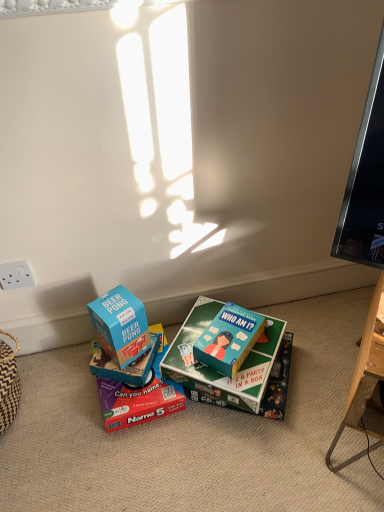
Question: From the image's perspective, is blue cardboard box at center, marked as the 4th box in a right-to-left arrangement, beneath white plastic power outlet at lower left?

Choices:
 (A) no
 (B) yes

Answer: (B)

Question: Is blue cardboard box at center, the second box when ordered from left to right, positioned behind white plastic power outlet at lower left?

Choices:
 (A) no
 (B) yes

Answer: (B)

Question: Is blue cardboard box at center, the second box when ordered from left to right, directly adjacent to white plastic power outlet at lower left?

Choices:
 (A) no
 (B) yes

Answer: (A)

Question: Is blue cardboard box at center, the second box when ordered from left to right, shorter than white plastic power outlet at lower left?

Choices:
 (A) no
 (B) yes

Answer: (B)

Question: Considering the relative sizes of blue cardboard box at center, marked as the 4th box in a right-to-left arrangement, and white plastic power outlet at lower left in the image provided, is blue cardboard box at center, marked as the 4th box in a right-to-left arrangement, smaller than white plastic power outlet at lower left?

Choices:
 (A) yes
 (B) no

Answer: (B)

Question: Is white plastic power outlet at lower left taller or shorter than blue cardboard box at center, acting as the 5th box starting from the right?

Choices:
 (A) tall
 (B) short

Answer: (B)

Question: Choose the correct answer: Is white plastic power outlet at lower left inside blue cardboard box at center, acting as the 5th box starting from the right, or outside it?

Choices:
 (A) outside
 (B) inside

Answer: (A)

Question: Is white plastic power outlet at lower left wider or thinner than blue cardboard box at center, the 1th box from the left?

Choices:
 (A) wide
 (B) thin

Answer: (B)

Question: Considering the positions of white plastic power outlet at lower left and blue cardboard box at center, the 1th box from the left, in the image, is white plastic power outlet at lower left bigger or smaller than blue cardboard box at center, the 1th box from the left,?

Choices:
 (A) small
 (B) big

Answer: (A)

Question: From a real-world perspective, relative to teal matte board game at center, which is counted as the 1th box, starting from the right, is teal matte board game at center, arranged as the 4th box when viewed from the left, vertically above or below?

Choices:
 (A) below
 (B) above

Answer: (A)

Question: Choose the correct answer: Is teal matte board game at center, the second box positioned from the right, inside teal matte board game at center, which is counted as the 1th box, starting from the right, or outside it?

Choices:
 (A) outside
 (B) inside

Answer: (A)

Question: From the image's perspective, relative to teal matte board game at center, which is counted as the 1th box, starting from the right, is teal matte board game at center, the second box positioned from the right, above or below?

Choices:
 (A) above
 (B) below

Answer: (B)

Question: Is point (269, 330) positioned closer to the camera than point (208, 340)?

Choices:
 (A) closer
 (B) farther

Answer: (B)

Question: Which is correct: teal matte board game at center, which is the 5th box from left to right, is inside matte cardboard box at center, which is counted as the 3th box, starting from the right, or outside of it?

Choices:
 (A) inside
 (B) outside

Answer: (B)

Question: Is teal matte board game at center, which is counted as the 1th box, starting from the right, bigger or smaller than matte cardboard box at center, which is counted as the 3th box, starting from the right?

Choices:
 (A) small
 (B) big

Answer: (A)